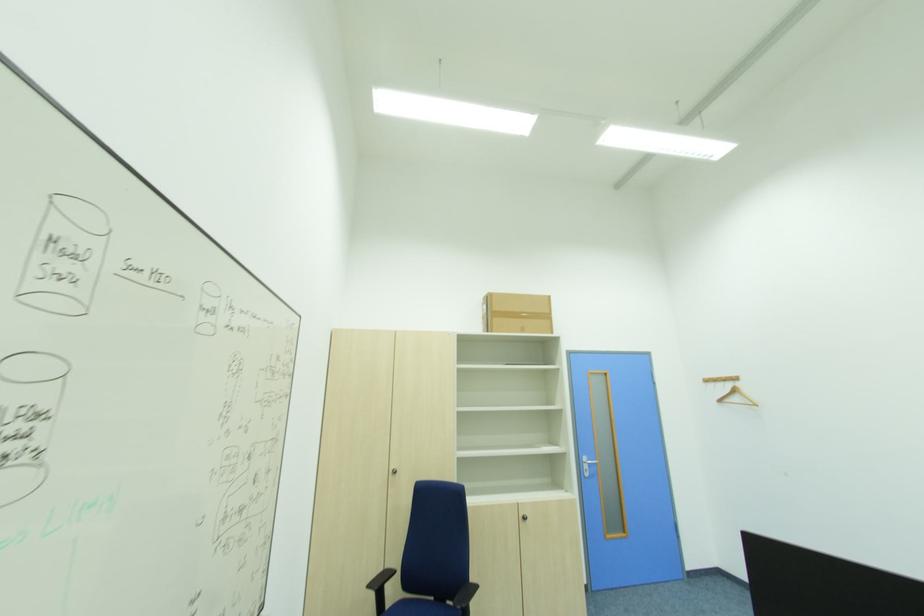
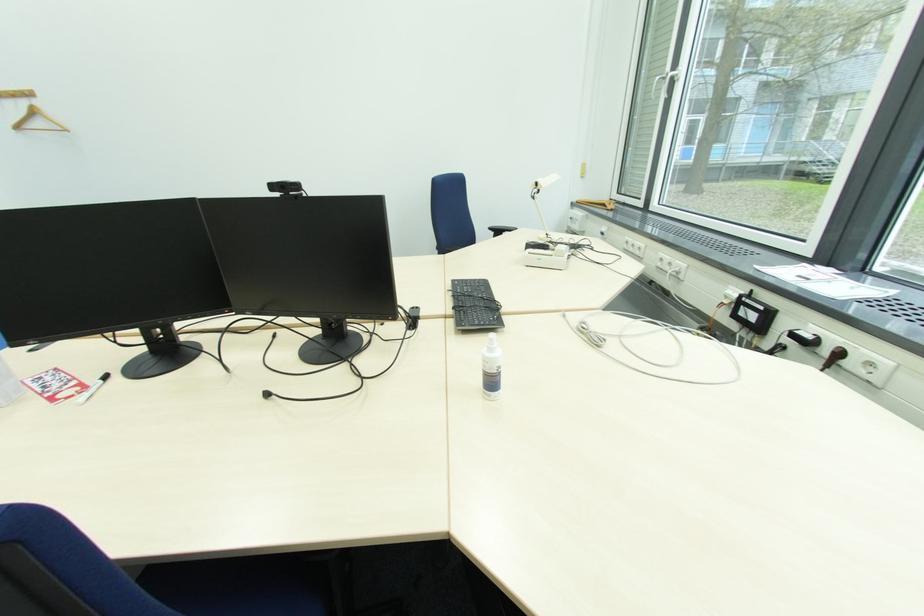
In the second image, find the point that corresponds to point (733, 387) in the first image.

(29, 105)